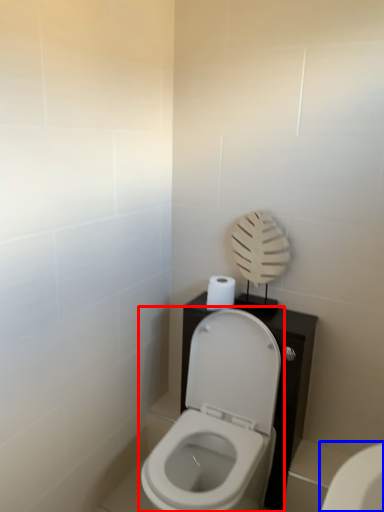
Question: Among these objects, which one is nearest to the camera, toilet (highlighted by a red box) or toilet (highlighted by a blue box)?

Choices:
 (A) toilet
 (B) toilet

Answer: (A)